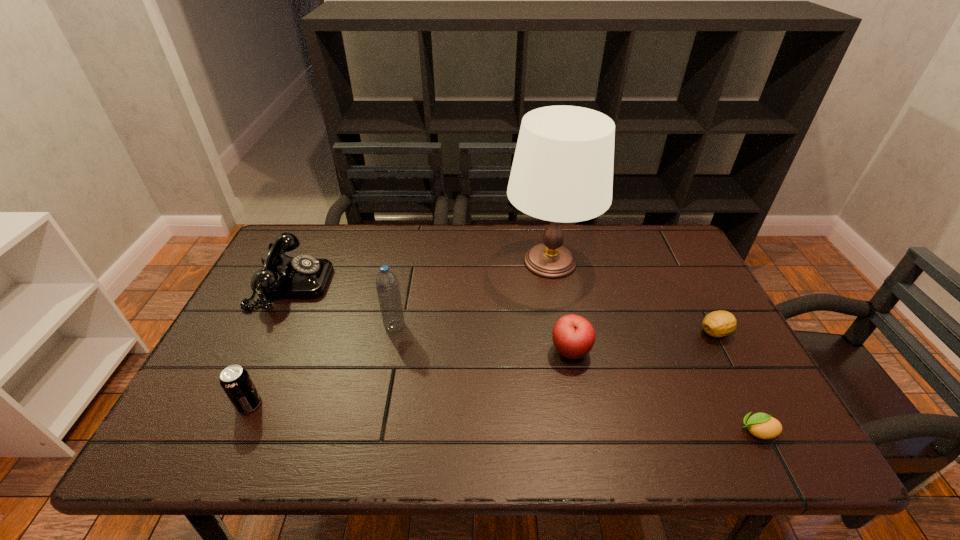
Image resolution: width=960 pixels, height=540 pixels. In the image, there is a desktop. Identify the location of free space at the left edge. (274, 352).

At what (x,y) coordinates should I click in order to perform the action: click on vacant region at the right edge of the desktop. Please return your answer as a coordinate pair (x, y). This screenshot has height=540, width=960. Looking at the image, I should click on (688, 276).

Where is `vacant space at the far left corner`? vacant space at the far left corner is located at coordinates (331, 232).

At what (x,y) coordinates should I click in order to perform the action: click on free point between the nearest object and the second shortest object. Please return your answer as a coordinate pair (x, y). Looking at the image, I should click on (736, 382).

Image resolution: width=960 pixels, height=540 pixels. What are the coordinates of `empty space between the telephone and the lamp` in the screenshot? It's located at (421, 273).

Where is `free point between the apple and the shortest object`? free point between the apple and the shortest object is located at coordinates (663, 391).

Locate an element on the screen. The image size is (960, 540). free spot between the telephone and the soda can is located at coordinates (271, 344).

Where is `free space between the telephone and the shorter lemon`? This screenshot has height=540, width=960. free space between the telephone and the shorter lemon is located at coordinates (524, 357).

Where is `free point between the water bottle and the tallest object`? free point between the water bottle and the tallest object is located at coordinates (472, 294).

Where is `empty space between the nearest object and the sixth farthest object`? The height and width of the screenshot is (540, 960). empty space between the nearest object and the sixth farthest object is located at coordinates (503, 418).